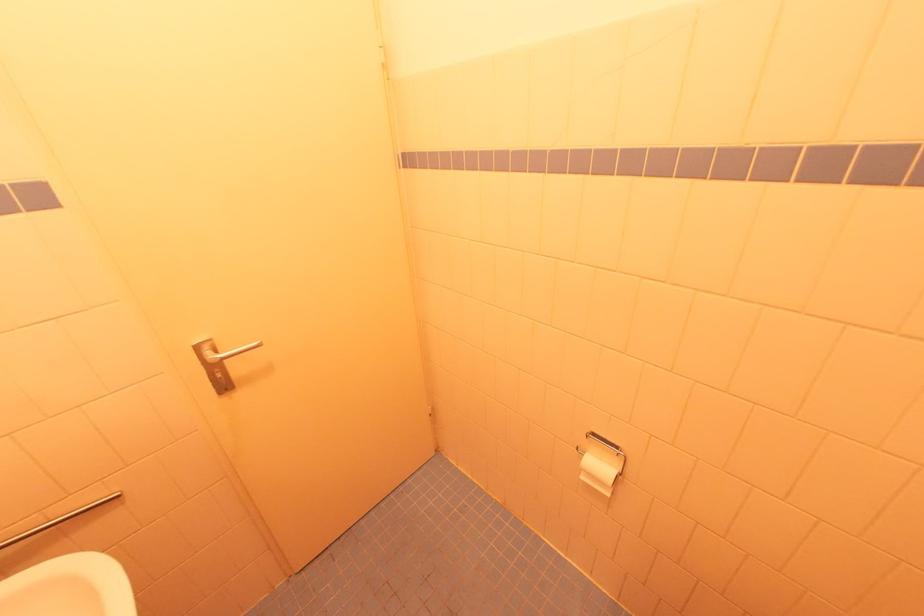
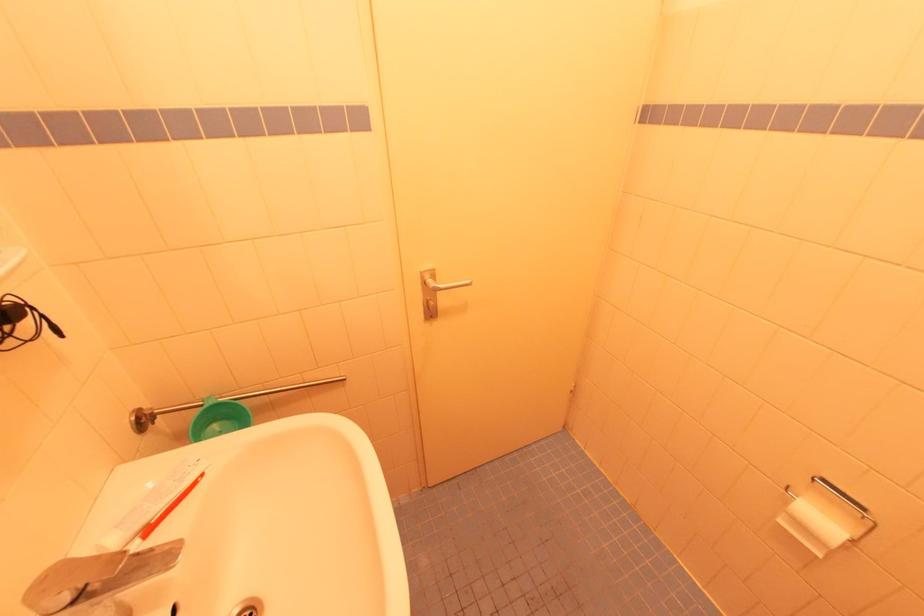
In the second image, find the point that corresponds to the point at 585,479 in the first image.

(784, 523)